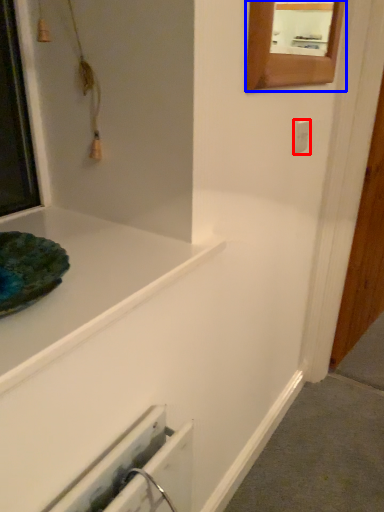
Question: Which point is further to the camera, electric outlet (highlighted by a red box) or mirror (highlighted by a blue box)?

Choices:
 (A) electric outlet
 (B) mirror

Answer: (A)